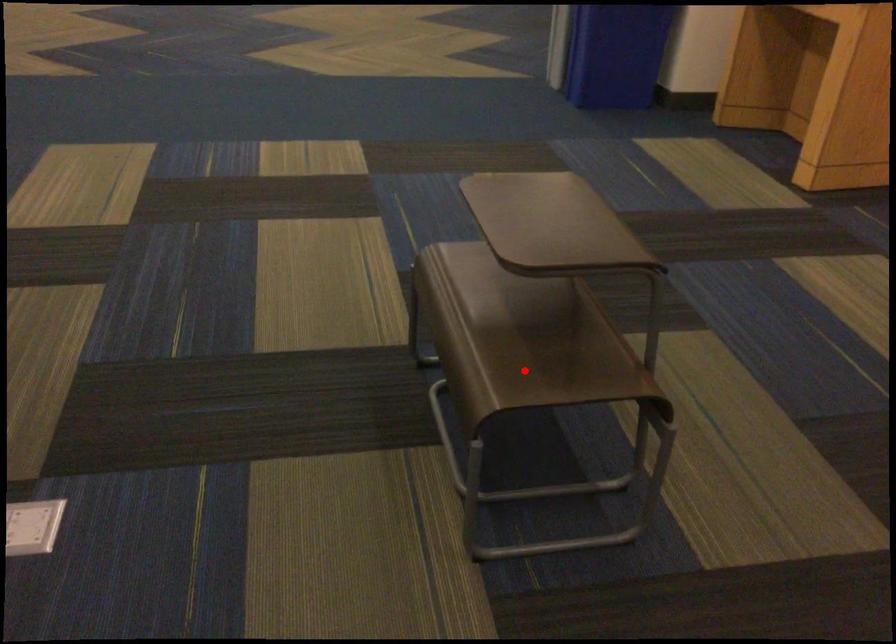
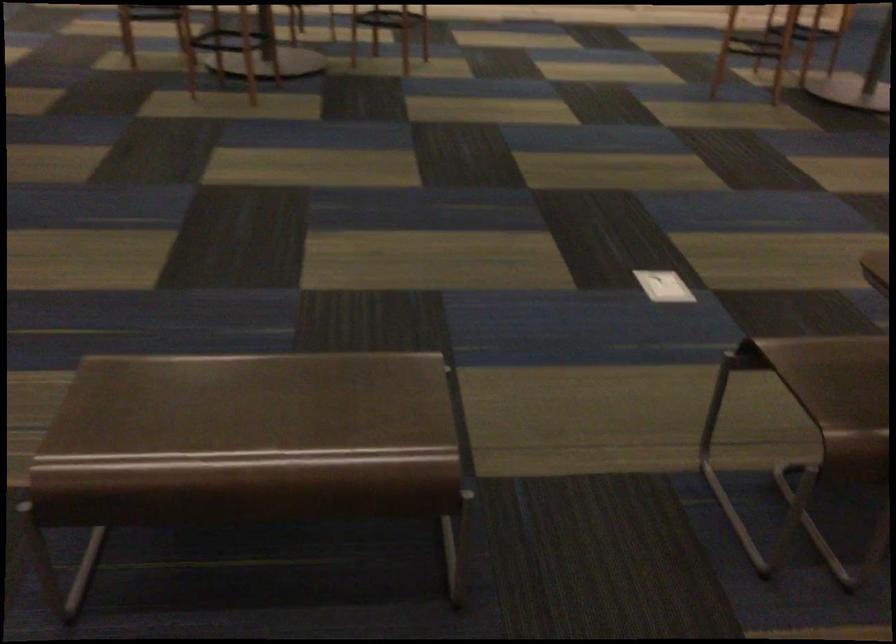
Where in the second image is the point corresponding to the highlighted location from the first image?

(823, 366)